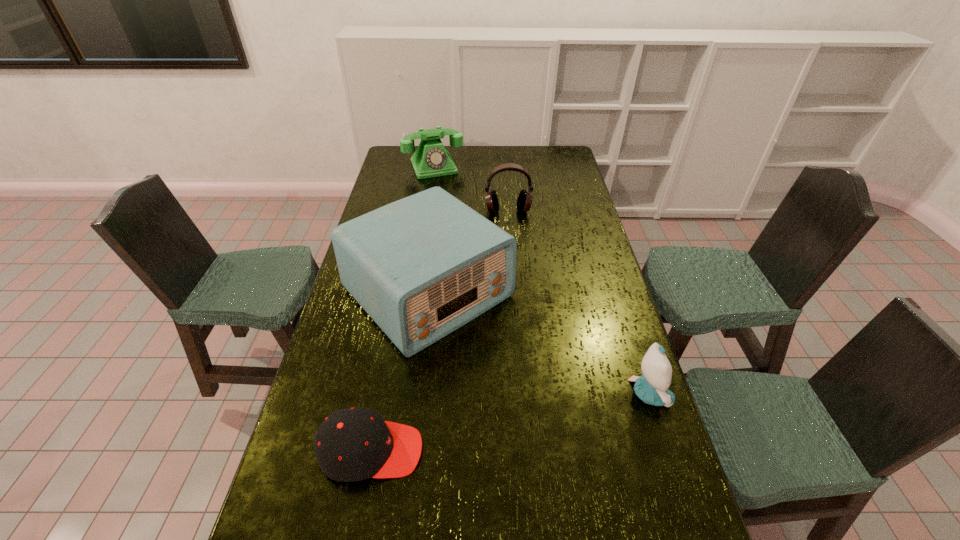
Locate an element on the screen. Image resolution: width=960 pixels, height=540 pixels. vacant space at the far right corner is located at coordinates (564, 159).

The width and height of the screenshot is (960, 540). Identify the location of vacant space in between the nearest object and the radio receiver. (400, 372).

This screenshot has height=540, width=960. In order to click on free space between the telephone and the kitten in this screenshot , I will do `click(541, 280)`.

At what (x,y) coordinates should I click in order to perform the action: click on free point between the headset and the rightmost object. Please return your answer as a coordinate pair (x, y). The width and height of the screenshot is (960, 540). Looking at the image, I should click on (579, 302).

Where is `unoccupied area between the kitten and the farthest object`? Image resolution: width=960 pixels, height=540 pixels. unoccupied area between the kitten and the farthest object is located at coordinates (541, 280).

Find the location of a particular element. This screenshot has height=540, width=960. free space between the rightmost object and the shortest object is located at coordinates (511, 422).

This screenshot has width=960, height=540. What are the coordinates of `the third closest object to the kitten` in the screenshot? It's located at (524, 201).

The width and height of the screenshot is (960, 540). I want to click on the third closest object to the tallest object, so click(652, 387).

The height and width of the screenshot is (540, 960). I want to click on free location that satisfies the following two spatial constraints: 1. on the back side of the headset; 2. on the right side of the radio receiver, so click(x=439, y=211).

You are a GUI agent. You are given a task and a screenshot of the screen. Output one action in this format:
    pyautogui.click(x=<x>, y=<y>)
    Task: Click on the free space that satisfies the following two spatial constraints: 1. on the front side of the rightmost object; 2. on the face of the farthest object
    
    Given the screenshot: What is the action you would take?
    pyautogui.click(x=397, y=394)